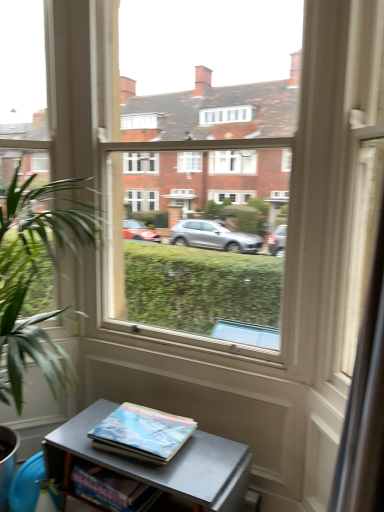
Question: Is hardcover book at lower center, which appears as the 1th book when ordered from the bottom, facing towards transparent glass door at center?

Choices:
 (A) yes
 (B) no

Answer: (B)

Question: Would you say transparent glass door at center is part of hardcover book at lower center, which appears as the 1th book when ordered from the bottom,'s contents?

Choices:
 (A) no
 (B) yes

Answer: (A)

Question: Is hardcover book at lower center, which appears as the 1th book when ordered from the bottom, next to transparent glass door at center?

Choices:
 (A) no
 (B) yes

Answer: (A)

Question: Is hardcover book at lower center, the 2th book from the top, further to the viewer compared to transparent glass door at center?

Choices:
 (A) no
 (B) yes

Answer: (B)

Question: Can you confirm if hardcover book at lower center, the 2th book from the top, is thinner than transparent glass door at center?

Choices:
 (A) yes
 (B) no

Answer: (A)

Question: In terms of size, does metallic gray table at lower center appear bigger or smaller than hardcover book at lower center, the 2th book from the top?

Choices:
 (A) big
 (B) small

Answer: (A)

Question: Considering the positions of metallic gray table at lower center and hardcover book at lower center, which appears as the 1th book when ordered from the bottom, in the image, is metallic gray table at lower center wider or thinner than hardcover book at lower center, which appears as the 1th book when ordered from the bottom,?

Choices:
 (A) thin
 (B) wide

Answer: (B)

Question: Is metallic gray table at lower center in front of or behind hardcover book at lower center, which appears as the 1th book when ordered from the bottom, in the image?

Choices:
 (A) front
 (B) behind

Answer: (A)

Question: From a real-world perspective, is metallic gray table at lower center positioned above or below hardcover book at lower center, which appears as the 1th book when ordered from the bottom?

Choices:
 (A) above
 (B) below

Answer: (B)

Question: Is hardcover book at center, marked as the 1th book in a top-to-bottom arrangement, bigger or smaller than green leafy plant at left?

Choices:
 (A) big
 (B) small

Answer: (B)

Question: Is hardcover book at center, the second book ordered from the bottom, in front of or behind green leafy plant at left in the image?

Choices:
 (A) front
 (B) behind

Answer: (B)

Question: In terms of height, does hardcover book at center, marked as the 1th book in a top-to-bottom arrangement, look taller or shorter compared to green leafy plant at left?

Choices:
 (A) tall
 (B) short

Answer: (B)

Question: From a real-world perspective, relative to green leafy plant at left, is hardcover book at center, marked as the 1th book in a top-to-bottom arrangement, vertically above or below?

Choices:
 (A) below
 (B) above

Answer: (A)

Question: From the image's perspective, is hardcover book at center, the second book ordered from the bottom, above or below hardcover book at lower center, the 2th book from the top?

Choices:
 (A) above
 (B) below

Answer: (A)

Question: Based on their positions, is hardcover book at center, the second book ordered from the bottom, located to the left or right of hardcover book at lower center, which appears as the 1th book when ordered from the bottom?

Choices:
 (A) right
 (B) left

Answer: (A)